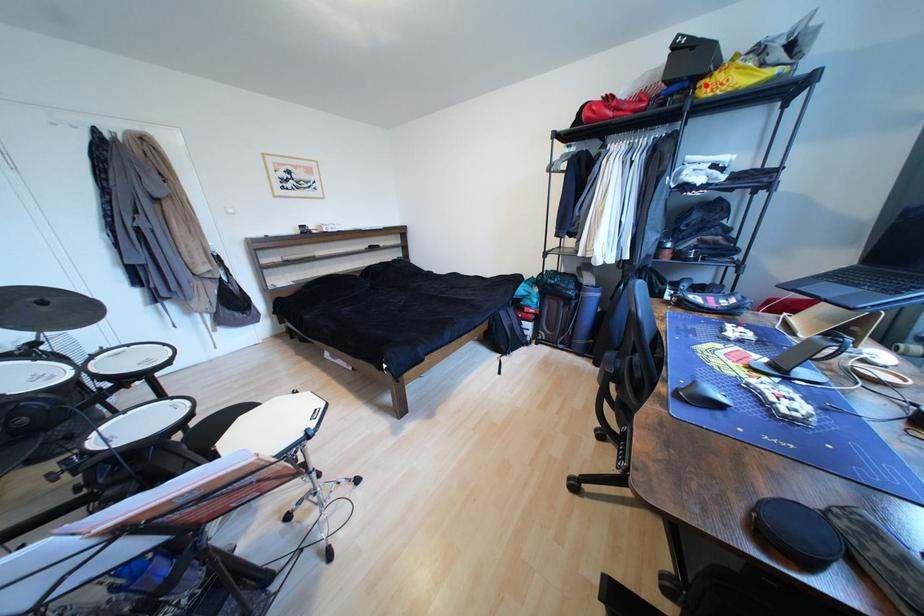
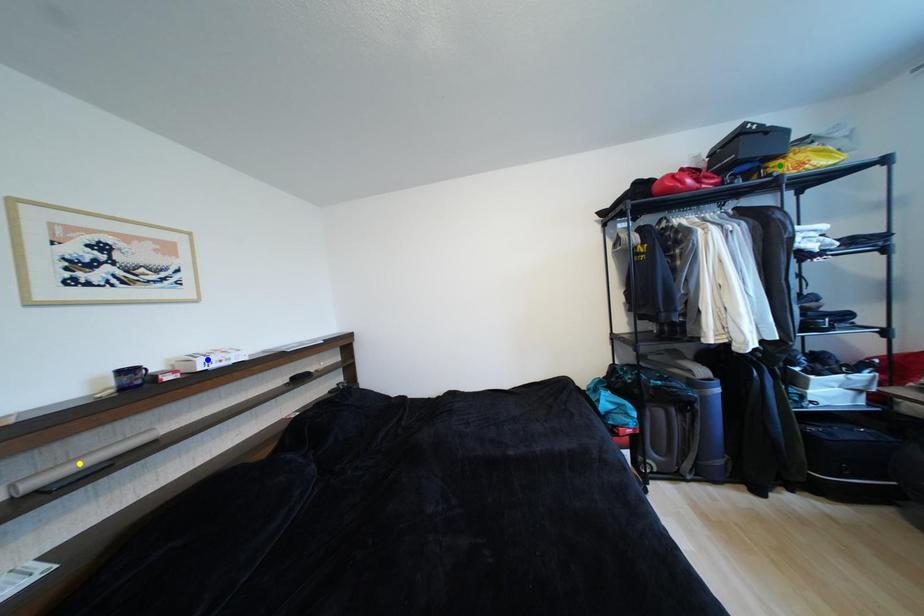
Question: I am providing you with two images of the same scene from different viewpoints. A red point is marked on the first image. You are given multiple points on the second image. Which point in image 2 is actually the same real-world point as the red point in image 1?

Choices:
 (A) blue point
 (B) yellow point
 (C) green point

Answer: (C)